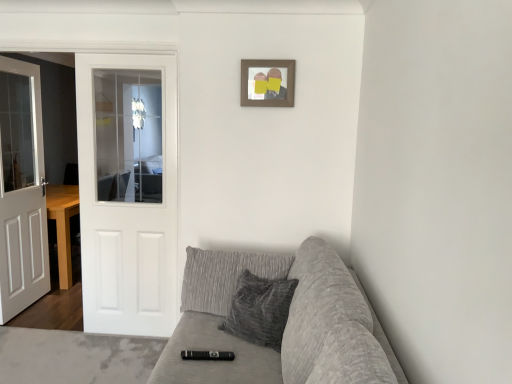
Question: Is wooden picture frame at upper center not near textured gray couch at lower right?

Choices:
 (A) yes
 (B) no

Answer: (A)

Question: From a real-world perspective, is wooden picture frame at upper center located higher than textured gray couch at lower right?

Choices:
 (A) no
 (B) yes

Answer: (B)

Question: Does wooden picture frame at upper center come in front of textured gray couch at lower right?

Choices:
 (A) no
 (B) yes

Answer: (A)

Question: Does wooden picture frame at upper center have a larger size compared to textured gray couch at lower right?

Choices:
 (A) yes
 (B) no

Answer: (B)

Question: Is wooden picture frame at upper center facing away from textured gray couch at lower right?

Choices:
 (A) yes
 (B) no

Answer: (B)

Question: Considering the positions of white glossy door at left, positioned as the 1th door in right-to-left order, and wooden picture frame at upper center in the image, is white glossy door at left, positioned as the 1th door in right-to-left order, wider or thinner than wooden picture frame at upper center?

Choices:
 (A) wide
 (B) thin

Answer: (A)

Question: Based on their sizes in the image, would you say white glossy door at left, positioned as the 1th door in right-to-left order, is bigger or smaller than wooden picture frame at upper center?

Choices:
 (A) small
 (B) big

Answer: (B)

Question: Relative to wooden picture frame at upper center, is white glossy door at left, the 2th door positioned from the left, in front or behind?

Choices:
 (A) front
 (B) behind

Answer: (B)

Question: Choose the correct answer: Is white glossy door at left, the 2th door positioned from the left, inside wooden picture frame at upper center or outside it?

Choices:
 (A) outside
 (B) inside

Answer: (A)

Question: Based on their positions, is white glossy door at left, the 2th door positioned from the left, located to the left or right of textured gray couch at lower right?

Choices:
 (A) right
 (B) left

Answer: (B)

Question: Considering the positions of white glossy door at left, the 2th door positioned from the left, and textured gray couch at lower right in the image, is white glossy door at left, the 2th door positioned from the left, wider or thinner than textured gray couch at lower right?

Choices:
 (A) wide
 (B) thin

Answer: (B)

Question: Does point [118, 259] appear closer or farther from the camera than point [189, 345]?

Choices:
 (A) farther
 (B) closer

Answer: (A)

Question: From their relative heights in the image, would you say white glossy door at left, the 2th door positioned from the left, is taller or shorter than textured gray couch at lower right?

Choices:
 (A) tall
 (B) short

Answer: (A)

Question: In terms of size, does textured gray couch at lower right appear bigger or smaller than black plastic remote at center?

Choices:
 (A) small
 (B) big

Answer: (B)

Question: From a real-world perspective, is textured gray couch at lower right positioned above or below black plastic remote at center?

Choices:
 (A) above
 (B) below

Answer: (B)